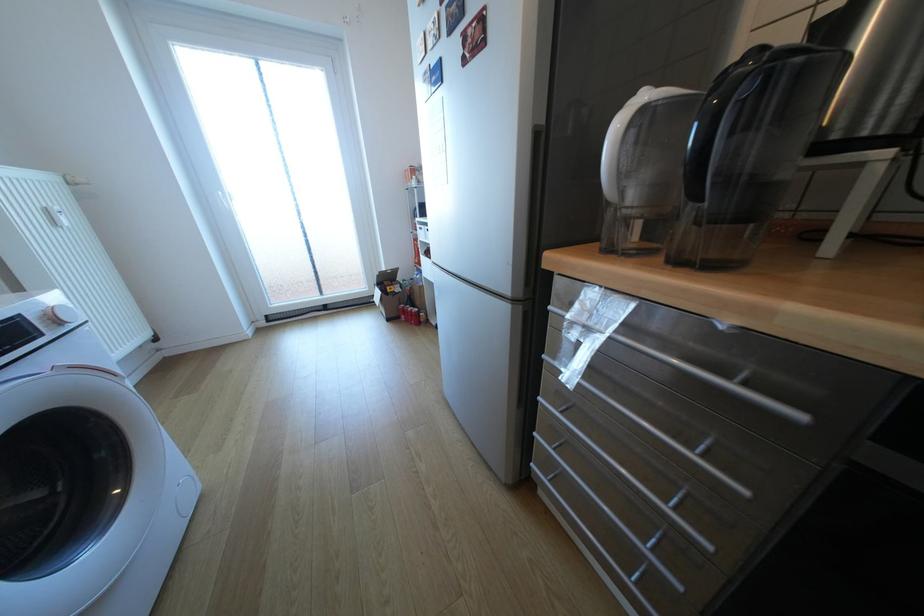
I want to click on black pitcher handle, so point(700,145).